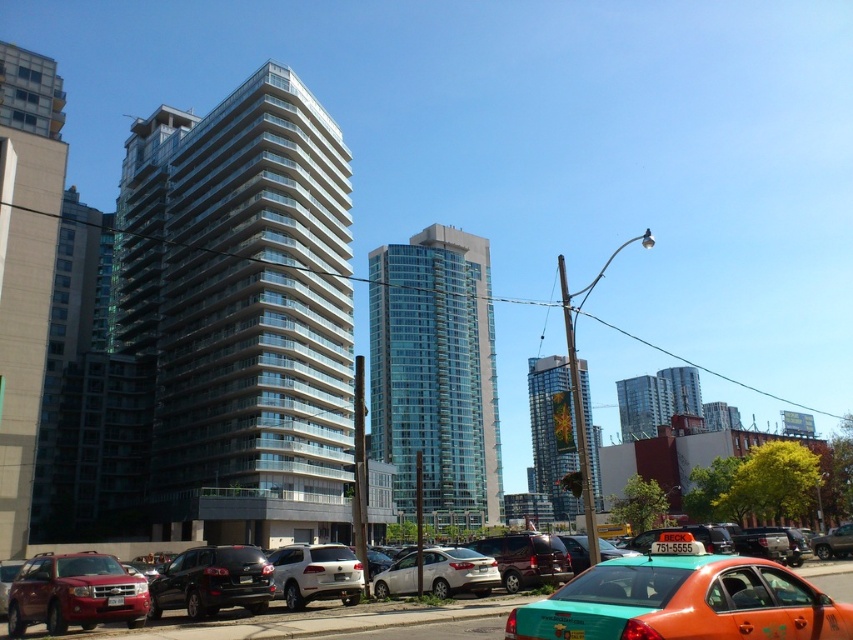
Question: Which object appears closest to the camera in this image?

Choices:
 (A) glassy concrete building at left
 (B) shiny black suv at center
 (C) transparent glass building at center

Answer: (B)

Question: Does matte black sedan at center appear over shiny black suv at center?

Choices:
 (A) yes
 (B) no

Answer: (A)

Question: Which object is positioned closest to the teal glossy taxi at lower right?

Choices:
 (A) white matte sedan at center
 (B) shiny black suv at center
 (C) white glass building at center

Answer: (B)

Question: Which object is farther from the camera taking this photo?

Choices:
 (A) shiny black suv at center
 (B) glassy concrete building at left
 (C) white matte sedan at center

Answer: (B)

Question: Does glassy reflective skyscraper at center appear under white matte sedan at center?

Choices:
 (A) yes
 (B) no

Answer: (A)

Question: Is matte red suv at lower left in front of white matte sedan at center?

Choices:
 (A) yes
 (B) no

Answer: (A)